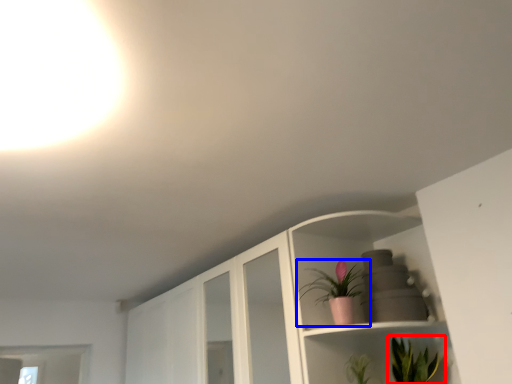
Question: Which object is further to the camera taking this photo, houseplant (highlighted by a red box) or houseplant (highlighted by a blue box)?

Choices:
 (A) houseplant
 (B) houseplant

Answer: (B)